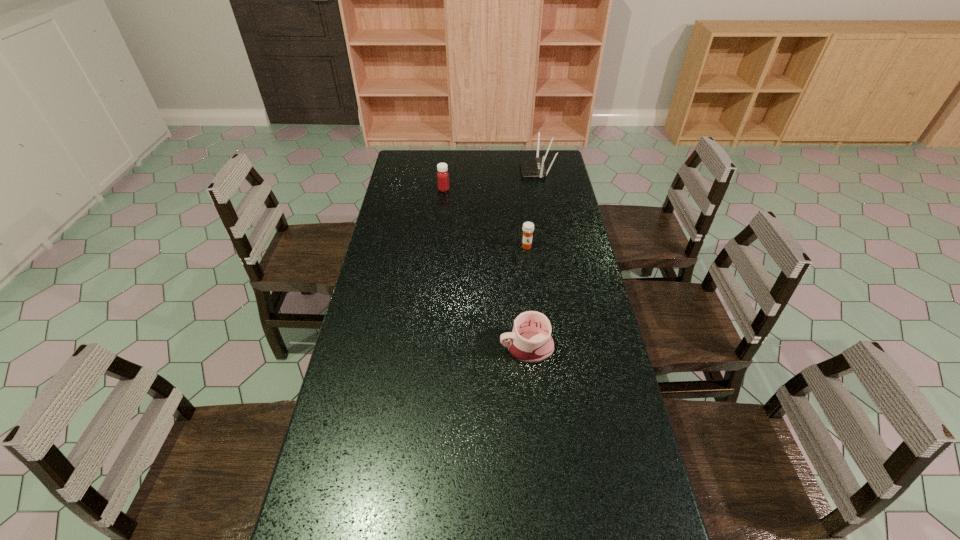
At what (x,y) coordinates should I click in order to perform the action: click on vacant space that satisfies the following two spatial constraints: 1. on the front-facing side of the router; 2. on the label side of the nearer medicine. Please return your answer as a coordinate pair (x, y). Image resolution: width=960 pixels, height=540 pixels. Looking at the image, I should click on (550, 247).